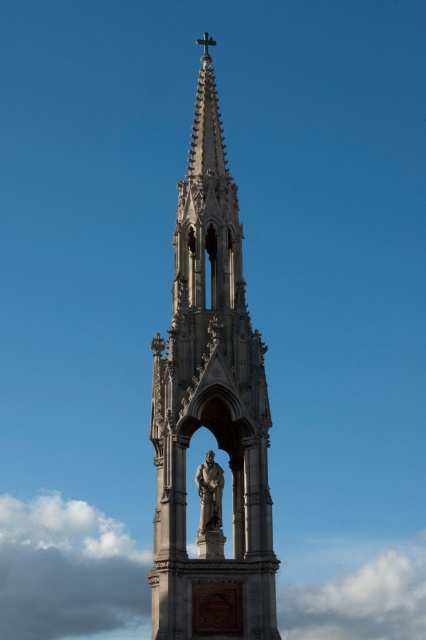
Question: Can you confirm if stone gothic tower at center is positioned to the right of bronze statue at center?

Choices:
 (A) no
 (B) yes

Answer: (A)

Question: Which point appears closest to the camera in this image?

Choices:
 (A) (218, 342)
 (B) (209, 499)

Answer: (A)

Question: Is the position of stone gothic tower at center more distant than that of bronze statue at center?

Choices:
 (A) no
 (B) yes

Answer: (A)

Question: Which of the following is the farthest from the observer?

Choices:
 (A) pyautogui.click(x=175, y=573)
 (B) pyautogui.click(x=215, y=512)

Answer: (B)

Question: Does stone gothic tower at center have a lesser width compared to bronze statue at center?

Choices:
 (A) no
 (B) yes

Answer: (A)

Question: Which point is closer to the camera?

Choices:
 (A) (203, 529)
 (B) (249, 620)

Answer: (B)